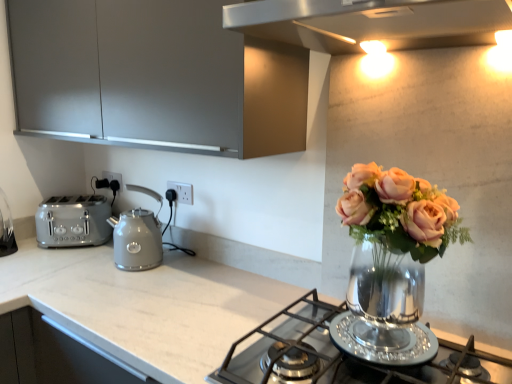
Question: Is matte gray cabinet at upper left bigger than white plastic electric outlet at center, which is counted as the first electric outlet, starting from the front?

Choices:
 (A) yes
 (B) no

Answer: (A)

Question: Is matte gray cabinet at upper left thinner than white plastic electric outlet at center, the second electric outlet positioned from the back?

Choices:
 (A) yes
 (B) no

Answer: (B)

Question: Does matte gray cabinet at upper left have a lesser height compared to white plastic electric outlet at center, which is counted as the first electric outlet, starting from the front?

Choices:
 (A) yes
 (B) no

Answer: (B)

Question: Can you confirm if matte gray cabinet at upper left is taller than white plastic electric outlet at center, which is counted as the first electric outlet, starting from the front?

Choices:
 (A) yes
 (B) no

Answer: (A)

Question: Does matte gray cabinet at upper left appear on the right side of white plastic electric outlet at center, arranged as the first electric outlet when viewed from the right?

Choices:
 (A) yes
 (B) no

Answer: (B)

Question: Is matte gray cabinet at upper left looking in the opposite direction of white plastic electric outlet at center, arranged as the first electric outlet when viewed from the right?

Choices:
 (A) no
 (B) yes

Answer: (A)

Question: Considering the relative sizes of matte gray kettle at center and satin silver toaster at left in the image provided, is matte gray kettle at center bigger than satin silver toaster at left?

Choices:
 (A) no
 (B) yes

Answer: (A)

Question: Does matte gray kettle at center have a lesser height compared to satin silver toaster at left?

Choices:
 (A) no
 (B) yes

Answer: (A)

Question: Are matte gray kettle at center and satin silver toaster at left located far from each other?

Choices:
 (A) no
 (B) yes

Answer: (A)

Question: Is matte gray kettle at center taller than satin silver toaster at left?

Choices:
 (A) yes
 (B) no

Answer: (A)

Question: Can you confirm if matte gray kettle at center is thinner than satin silver toaster at left?

Choices:
 (A) yes
 (B) no

Answer: (A)

Question: Does matte gray kettle at center have a greater width compared to satin silver toaster at left?

Choices:
 (A) yes
 (B) no

Answer: (B)

Question: Are matte gray cabinet at upper left and white plastic electric outlet at center, which appears as the 1th electric outlet when viewed from the left, located far from each other?

Choices:
 (A) yes
 (B) no

Answer: (B)